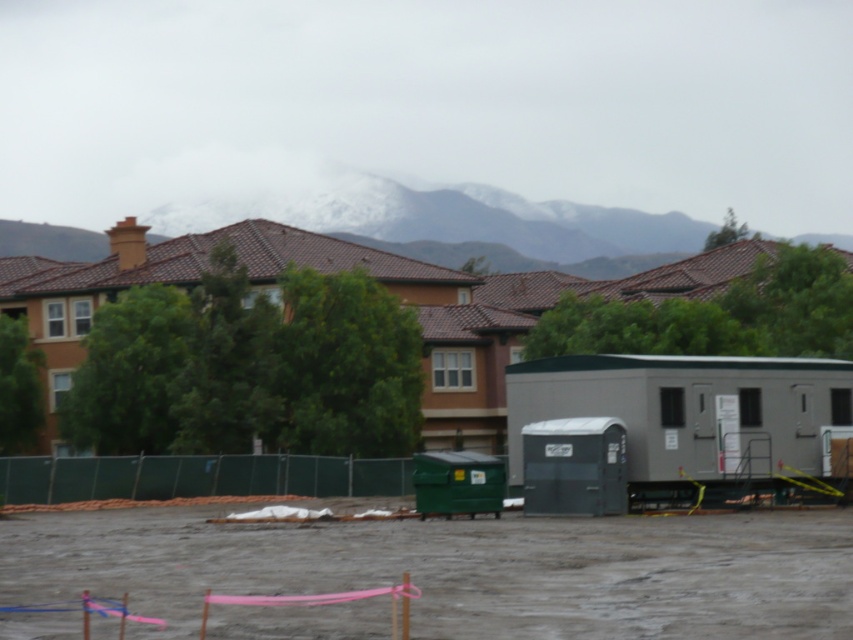
You are a delivery driver who needs to navigate through the construction site. You see the snowy mountain at upper center and the green mesh fence at lower center. Which object is higher in the image?

The snowy mountain at upper center is higher than the green mesh fence at lower center because it is positioned above it in the image.

You are a delivery person trying to navigate through the construction site. You need to deliver a package to the area behind the green mesh fence at lower center. From your current position, which direction should you move relative to the snowy mountain at upper center to reach the fence?

The snowy mountain at upper center is to the right of the green mesh fence at lower center. Therefore, to reach the green mesh fence at lower center, you should move to the left relative to the snowy mountain at upper center.